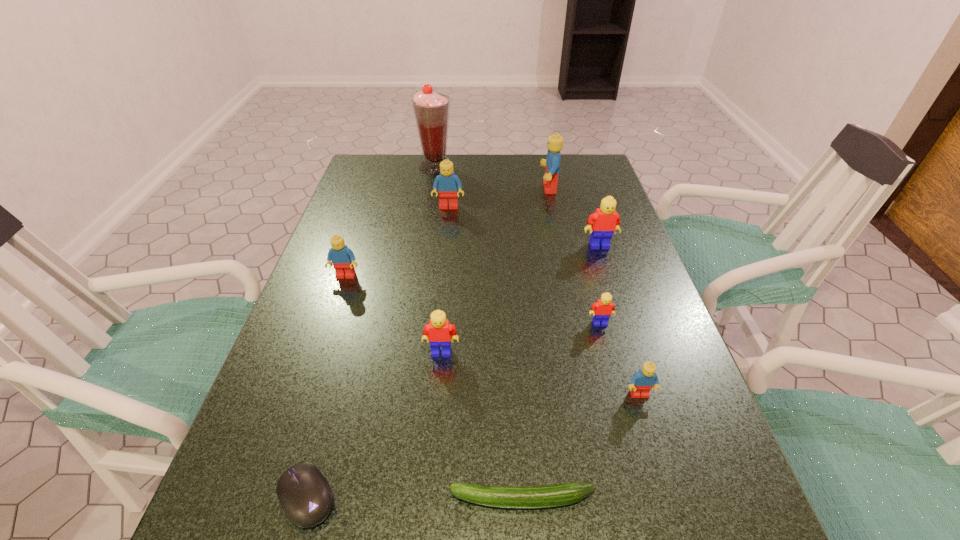
Find the location of a particular element. The height and width of the screenshot is (540, 960). the farthest object is located at coordinates (431, 110).

Locate an element on the screen. This screenshot has height=540, width=960. smoothie is located at coordinates (431, 110).

Identify the location of the biggest blue Lego. This screenshot has height=540, width=960. (555, 142).

Locate an element on the screen. This screenshot has width=960, height=540. the tallest Lego is located at coordinates (555, 142).

Identify the location of the sixth nearest Lego. (447, 183).

Image resolution: width=960 pixels, height=540 pixels. Identify the location of the second biggest blue Lego. (447, 183).

You are a GUI agent. You are given a task and a screenshot of the screen. Output one action in this format:
    pyautogui.click(x=<x>, y=<y>)
    Task: Click on the farthest yellow Lego
    The image size is (960, 540).
    Given the screenshot: What is the action you would take?
    pyautogui.click(x=604, y=222)

Image resolution: width=960 pixels, height=540 pixels. Identify the location of the fourth farthest object. (604, 222).

What are the coordinates of `the second nearest blue Lego` in the screenshot? It's located at (342, 258).

At what (x,y) coordinates should I click in order to perform the action: click on the leftmost Lego. Please return your answer as a coordinate pair (x, y). Looking at the image, I should click on (342, 258).